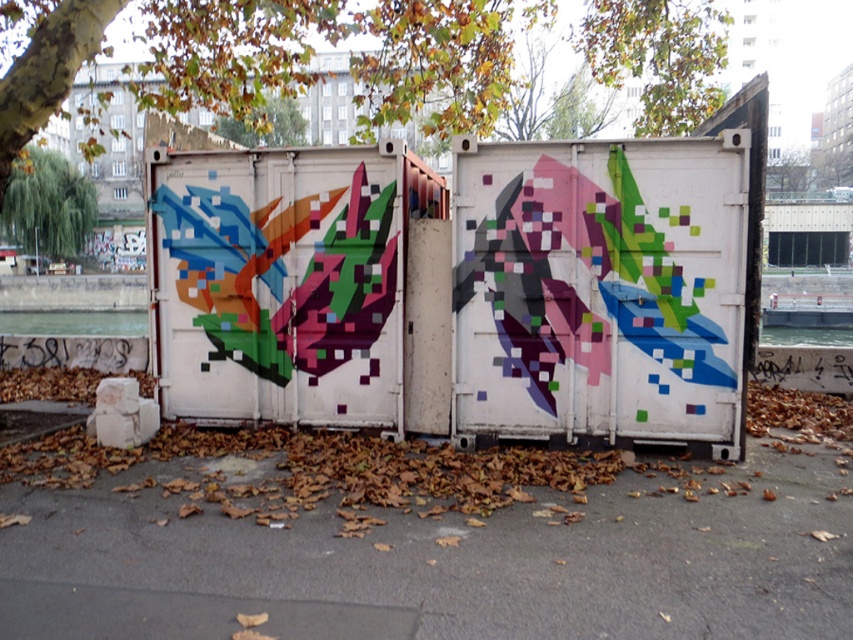
Question: Which point is farther to the camera?

Choices:
 (A) green leafy tree at upper center
 (B) green leafy tree at left
 (C) brown asphalt at center

Answer: (A)

Question: Does brown asphalt at center appear under green leafy tree at left?

Choices:
 (A) yes
 (B) no

Answer: (A)

Question: Does brown asphalt at center appear on the left side of green leafy tree at upper center?

Choices:
 (A) no
 (B) yes

Answer: (A)

Question: Observing the image, what is the correct spatial positioning of green leafy tree at left in reference to green leafy tree at upper center?

Choices:
 (A) left
 (B) right

Answer: (A)

Question: Which of these objects is positioned closest to the brown asphalt at center?

Choices:
 (A) green leafy tree at upper center
 (B) green leafy tree at left

Answer: (B)

Question: Which of the following is the closest to the observer?

Choices:
 (A) brown asphalt at center
 (B) green leafy tree at left
 (C) green leafy tree at upper center

Answer: (A)